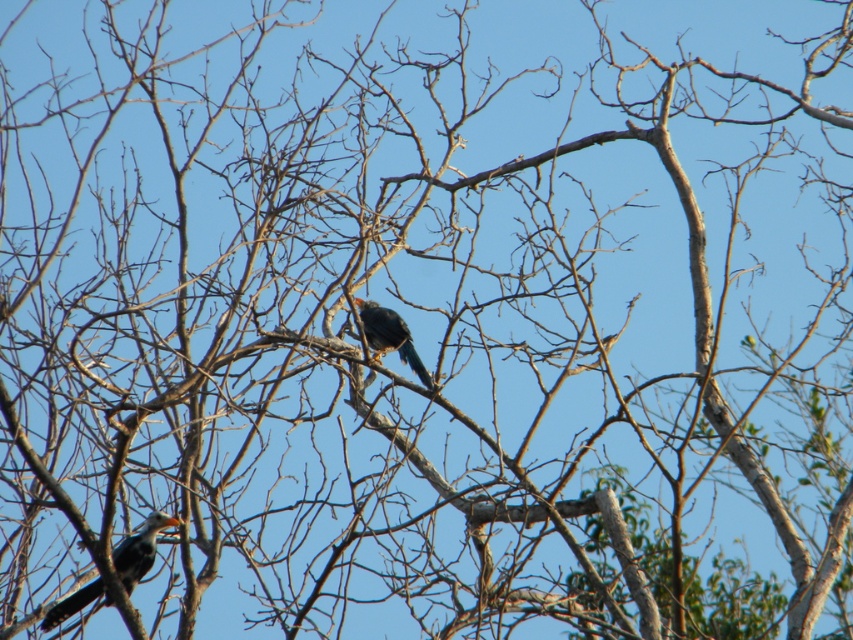
Question: Among these objects, which one is nearest to the camera?

Choices:
 (A) shiny black bird at center
 (B) matte black bird at lower left

Answer: (B)

Question: Among these objects, which one is farthest from the camera?

Choices:
 (A) shiny black bird at center
 (B) matte black bird at lower left

Answer: (A)

Question: Which point is closer to the camera?

Choices:
 (A) (383, 326)
 (B) (144, 566)

Answer: (B)

Question: Is matte black bird at lower left wider than shiny black bird at center?

Choices:
 (A) yes
 (B) no

Answer: (A)

Question: Can you confirm if matte black bird at lower left is positioned to the left of shiny black bird at center?

Choices:
 (A) yes
 (B) no

Answer: (A)

Question: Is matte black bird at lower left below shiny black bird at center?

Choices:
 (A) yes
 (B) no

Answer: (A)